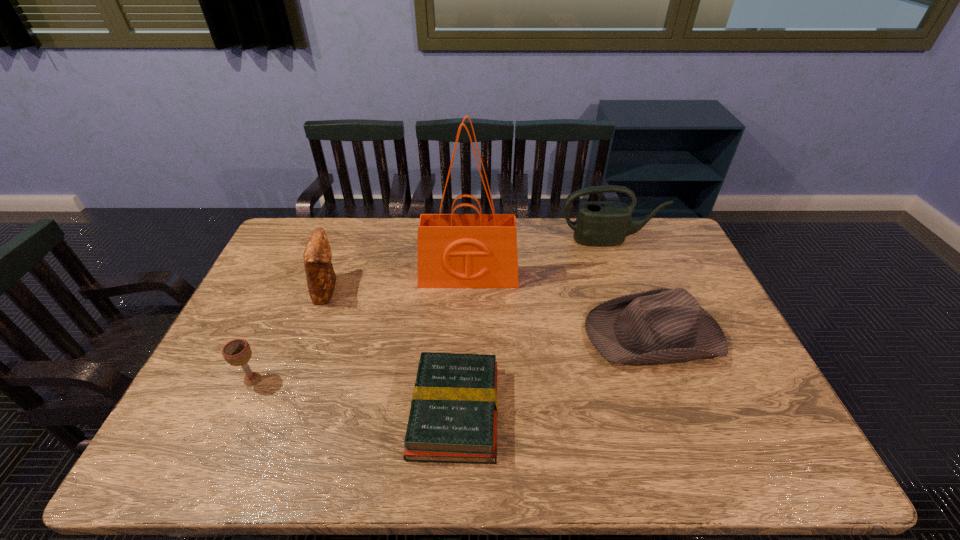
Where is `free spot at the near edge of the desktop`? The height and width of the screenshot is (540, 960). free spot at the near edge of the desktop is located at coordinates (274, 460).

In the image, there is a desktop. Identify the location of vacant area at the left edge. This screenshot has height=540, width=960. (273, 360).

The image size is (960, 540). In order to click on vacant point at the right edge in this screenshot , I will do `click(699, 375)`.

The image size is (960, 540). In order to click on vacant space at the far right corner in this screenshot , I will do `click(639, 238)`.

Identify the location of vacant area that lies between the hardback book and the fedora. The height and width of the screenshot is (540, 960). (554, 372).

Identify the location of vacant space in between the clutch bag and the tallest object. (398, 283).

Find the location of a particular element. The width and height of the screenshot is (960, 540). free spot between the shortest object and the tallest object is located at coordinates (462, 344).

You are a GUI agent. You are given a task and a screenshot of the screen. Output one action in this format:
    pyautogui.click(x=<x>, y=<y>)
    Task: Click on the free space between the leftmost object and the fourth shortest object
    
    Given the screenshot: What is the action you would take?
    pyautogui.click(x=290, y=334)

The width and height of the screenshot is (960, 540). I want to click on free space between the tallest object and the shortest object, so click(462, 344).

What are the coordinates of `blank region between the chalice and the watering can` in the screenshot? It's located at (431, 309).